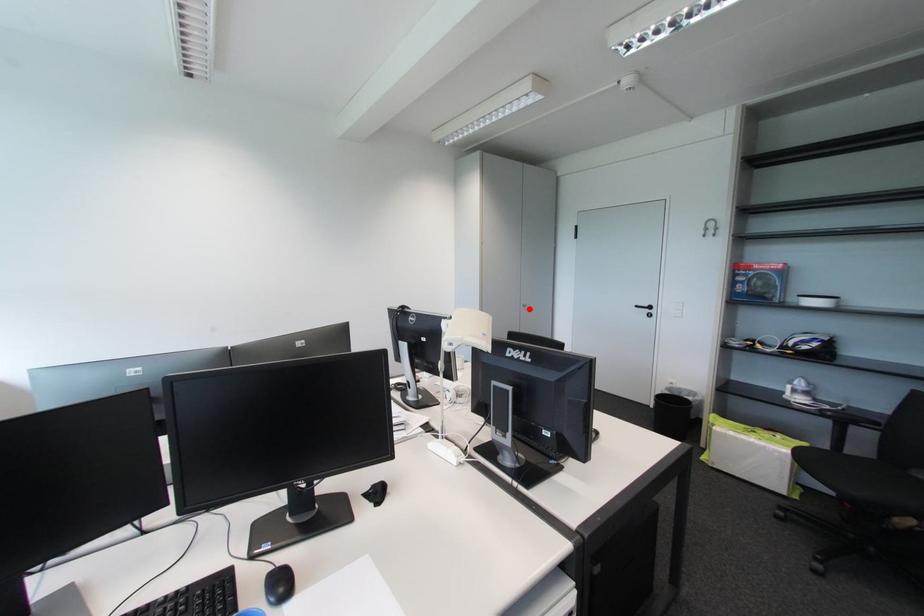
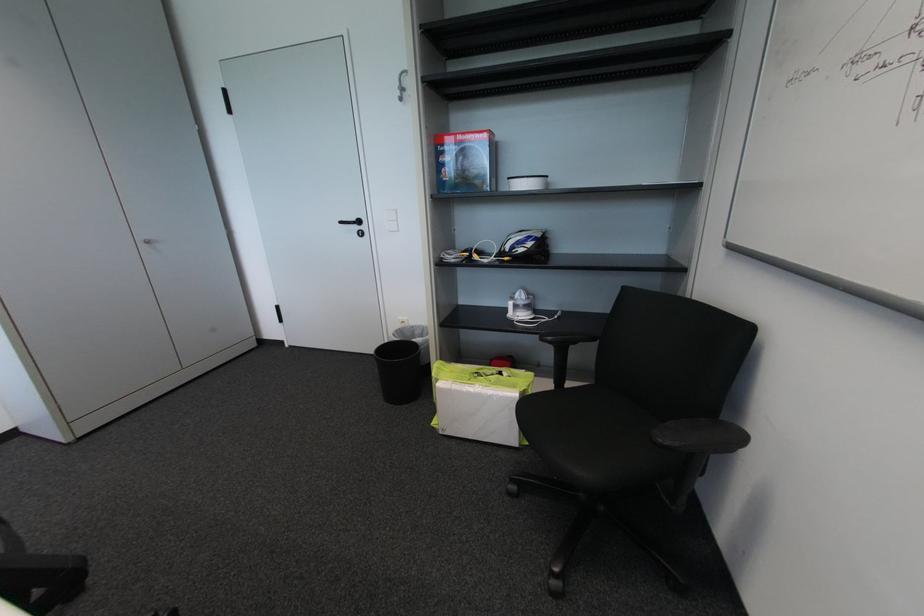
Find the pixel in the second image that matches the highlighted location in the first image.

(151, 246)